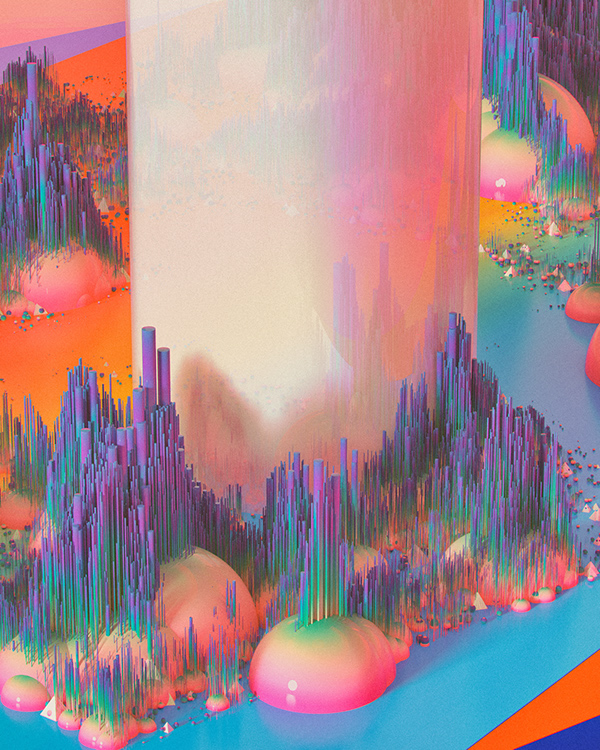
Locate an element on the screen. white  light is located at coordinates (253, 280).